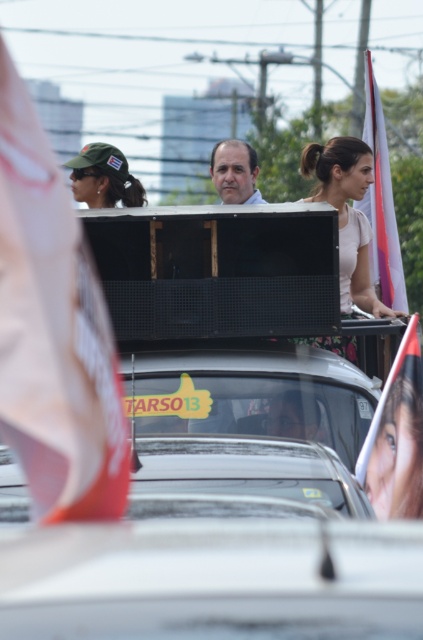
Does smooth skin face at center appear over white fabric flag at right?

Incorrect, smooth skin face at center is not positioned above white fabric flag at right.

Does smooth skin face at center appear on the left side of white fabric flag at right?

→ Correct, you'll find smooth skin face at center to the left of white fabric flag at right.

Find the location of a particular element. Image resolution: width=423 pixels, height=640 pixels. smooth skin face at center is located at coordinates (398, 452).

Does green fabric cap at upper left have a smaller size compared to matte brown head at center?

Indeed, green fabric cap at upper left has a smaller size compared to matte brown head at center.

Does green fabric cap at upper left appear over matte brown head at center?

Yes, green fabric cap at upper left is above matte brown head at center.

Between point (84, 196) and point (214, 147), which one is positioned behind?

The point (214, 147) is behind.

What are the coordinates of `green fabric cap at upper left` in the screenshot? It's located at click(104, 177).

Is green fabric flag at upper left wider than matte brown head at center?

In fact, green fabric flag at upper left might be narrower than matte brown head at center.

How much distance is there between green fabric flag at upper left and matte brown head at center?

green fabric flag at upper left and matte brown head at center are 6.91 meters apart from each other.

Is point (85, 445) closer to viewer compared to point (230, 148)?

Yes, it is.

The height and width of the screenshot is (640, 423). Find the location of `green fabric flag at upper left`. green fabric flag at upper left is located at coordinates (54, 332).